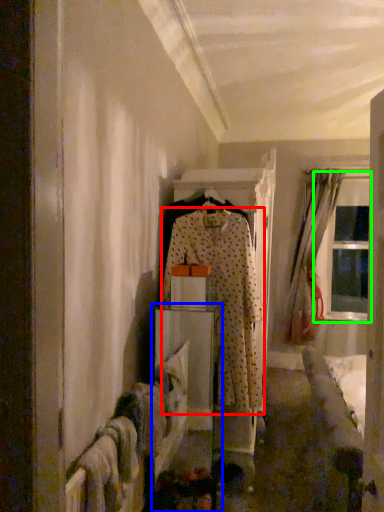
Question: Which is farther away from fancy dress (highlighted by a red box)? furniture (highlighted by a blue box) or window (highlighted by a green box)?

Choices:
 (A) furniture
 (B) window

Answer: (B)